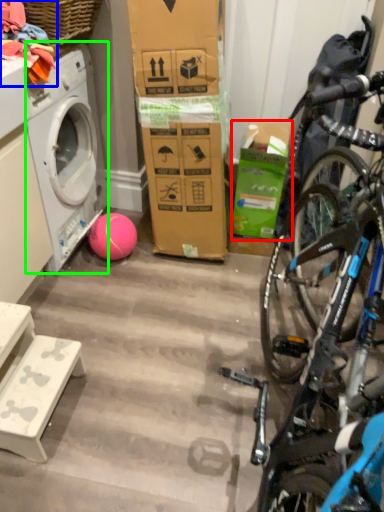
Question: Which object is positioned farthest from box (highlighted by a red box)? Select from clothing (highlighted by a blue box) and washing machine (highlighted by a green box).

Choices:
 (A) clothing
 (B) washing machine

Answer: (A)